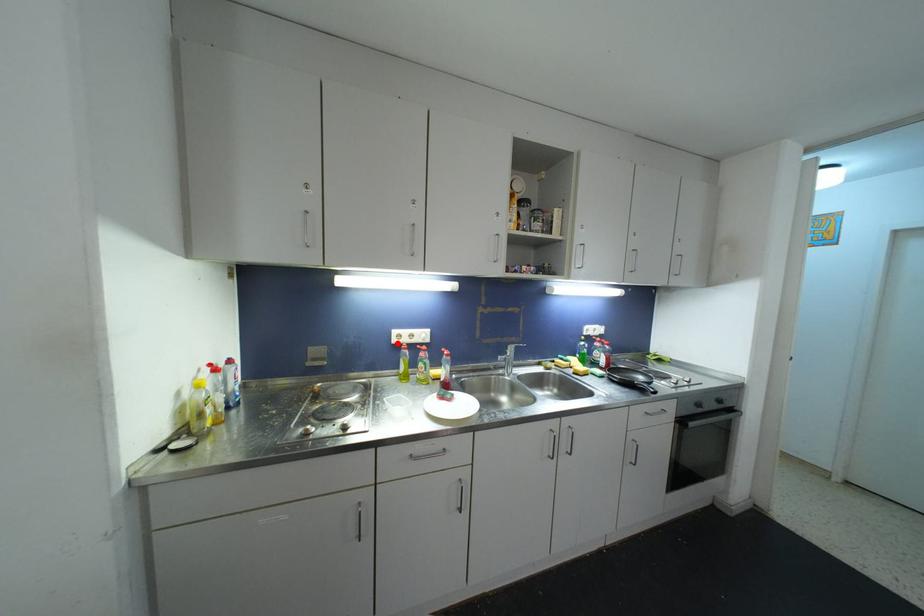
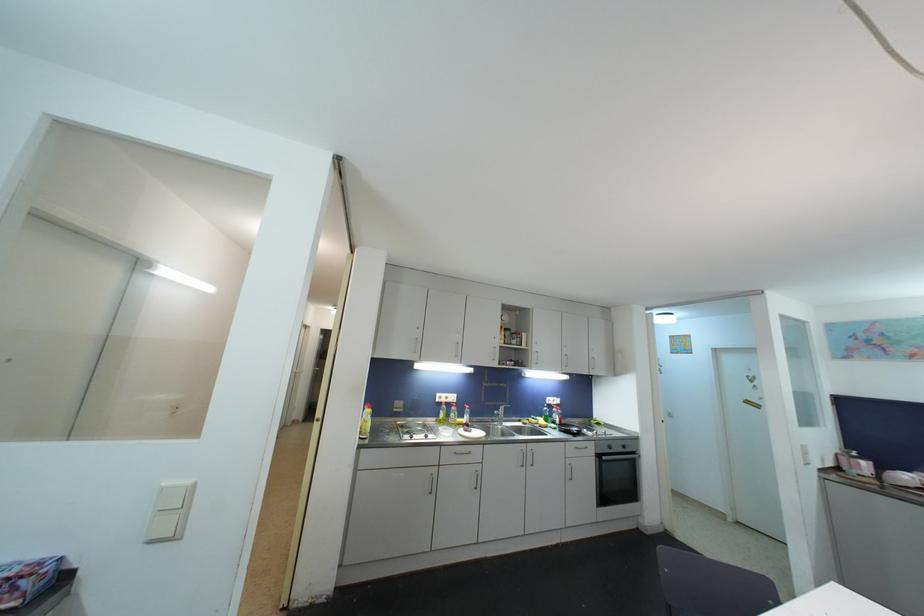
Locate, in the second image, the point that corresponds to the highlighted location in the first image.

(441, 403)